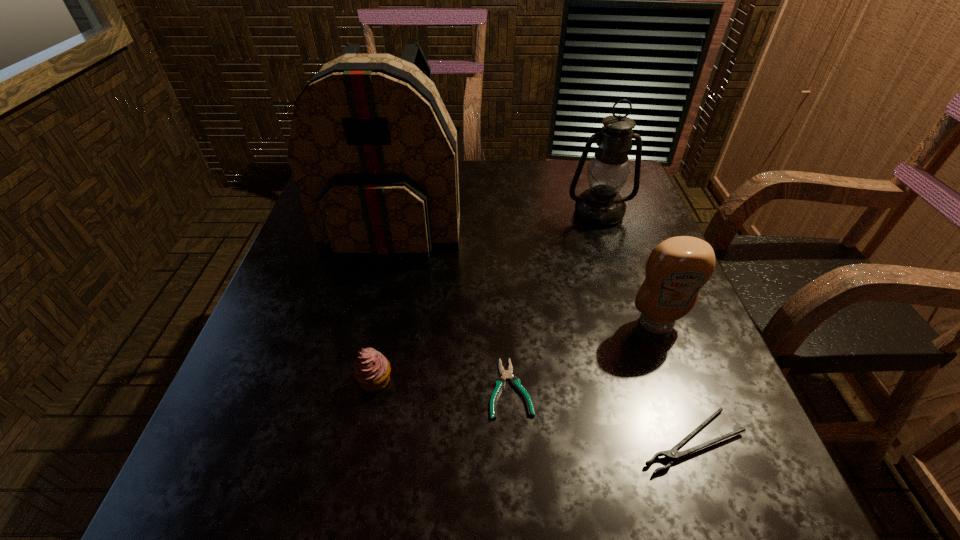
Locate an element on the screen. This screenshot has width=960, height=540. vacant space that is in between the fourth nearest object and the tongs is located at coordinates (674, 382).

Find the location of a particular element. This screenshot has width=960, height=540. free space that is in between the fourth nearest object and the second shortest object is located at coordinates (674, 382).

I want to click on empty location between the backpack and the cupcake, so click(x=385, y=301).

Locate an element on the screen. The image size is (960, 540). vacant space in between the fourth object from right to left and the fourth nearest object is located at coordinates (584, 356).

The height and width of the screenshot is (540, 960). I want to click on free space between the third shortest object and the shortest object, so click(x=443, y=384).

You are a GUI agent. You are given a task and a screenshot of the screen. Output one action in this format:
    pyautogui.click(x=<x>, y=<y>)
    Task: Click on the empty space between the third farthest object and the cupcake
    Image resolution: width=960 pixels, height=540 pixels.
    Given the screenshot: What is the action you would take?
    pyautogui.click(x=516, y=352)

Where is `unoccupied area between the oil lamp and the backpack`? The width and height of the screenshot is (960, 540). unoccupied area between the oil lamp and the backpack is located at coordinates (496, 217).

Where is `vacant area between the backpack and the second tallest object`? This screenshot has height=540, width=960. vacant area between the backpack and the second tallest object is located at coordinates (496, 217).

Where is `object that is the third nearest to the fourth object from right to left`? object that is the third nearest to the fourth object from right to left is located at coordinates (677, 268).

Locate an element on the screen. This screenshot has height=540, width=960. the third closest object to the second tallest object is located at coordinates (500, 382).